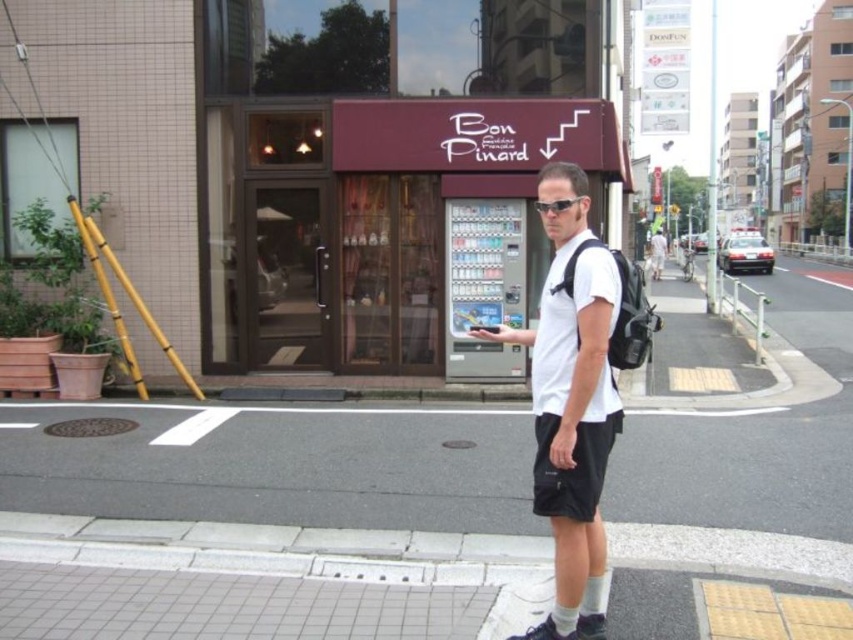
Question: Does white matte shorts at center have a lesser width compared to white cotton shirt at center?

Choices:
 (A) no
 (B) yes

Answer: (B)

Question: Can you confirm if white matte shorts at center is thinner than sunglasses at center?

Choices:
 (A) yes
 (B) no

Answer: (B)

Question: Can you confirm if white cotton shirt at center is wider than sunglasses at center?

Choices:
 (A) no
 (B) yes

Answer: (B)

Question: Which object appears closest to the camera in this image?

Choices:
 (A) sunglasses at center
 (B) white matte shorts at center

Answer: (B)

Question: Among these objects, which one is nearest to the camera?

Choices:
 (A) sunglasses at center
 (B) white cotton shirt at center

Answer: (A)

Question: Which of the following is the farthest from the observer?

Choices:
 (A) white matte shorts at center
 (B) white cotton shirt at center

Answer: (B)